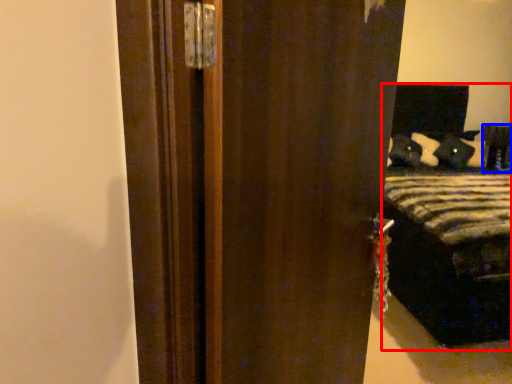
Question: Which object is closer to the camera taking this photo, bed (highlighted by a red box) or furniture (highlighted by a blue box)?

Choices:
 (A) bed
 (B) furniture

Answer: (A)